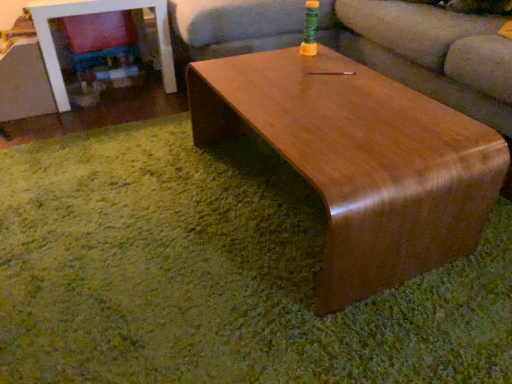
You are a GUI agent. You are given a task and a screenshot of the screen. Output one action in this format:
    pyautogui.click(x=<x>, y=<y>)
    Task: Click on the vacant space that is to the left of shiny brown wood coffee table at center
    This screenshot has width=512, height=384.
    Given the screenshot: What is the action you would take?
    pyautogui.click(x=128, y=200)